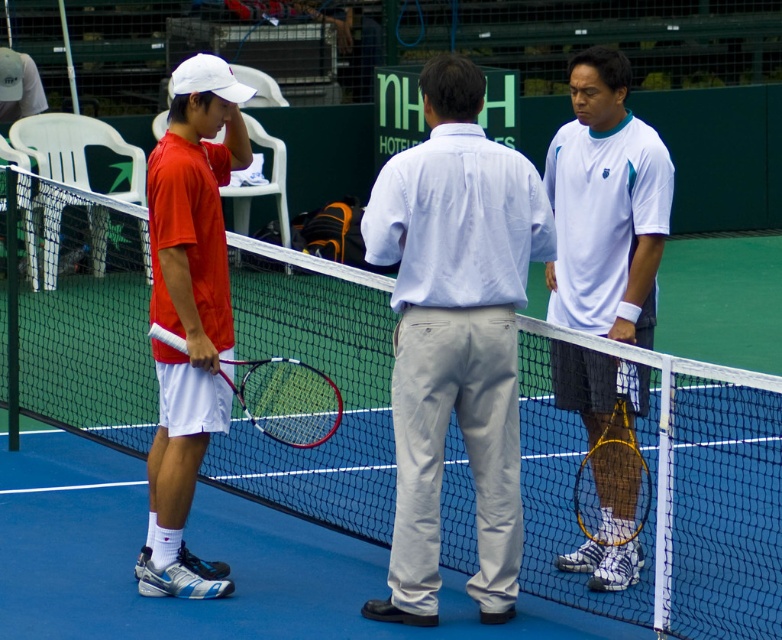
Question: Among these points, which one is nearest to the camera?

Choices:
 (A) (506, 388)
 (B) (522, 484)

Answer: (B)

Question: Which object is farther from the camera taking this photo?

Choices:
 (A) matte red shirt at left
 (B) white matte tennis racket at right

Answer: (A)

Question: Is light blue cotton shirt at center positioned before wooden tennis racket at right?

Choices:
 (A) yes
 (B) no

Answer: (A)

Question: Which point is farther to the camera?

Choices:
 (A) (253, 420)
 (B) (235, 419)
 (C) (551, 273)
 (D) (508, 179)

Answer: (B)

Question: Is white mesh tennis net at center to the left of light blue cotton shirt at center from the viewer's perspective?

Choices:
 (A) yes
 (B) no

Answer: (A)

Question: Is light blue cotton shirt at center wider than white matte tennis racket at right?

Choices:
 (A) no
 (B) yes

Answer: (B)